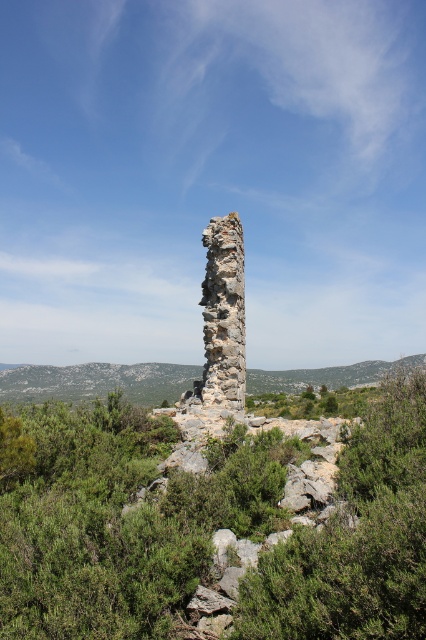
Question: Which of the following is the farthest from the observer?

Choices:
 (A) green leafy shrubs at center
 (B) green mossy hillside at center

Answer: (B)

Question: Which point is closer to the camera?

Choices:
 (A) (97, 385)
 (B) (374, 634)
 (C) (32, 588)

Answer: (B)

Question: Which point is farther to the camera?

Choices:
 (A) green leafy shrubs at center
 (B) green mossy hillside at center
 (C) green leafy shrub at center

Answer: (B)

Question: Is green leafy shrub at center closer to camera compared to green mossy hillside at center?

Choices:
 (A) no
 (B) yes

Answer: (B)

Question: Is green leafy shrub at center bigger than green mossy hillside at center?

Choices:
 (A) no
 (B) yes

Answer: (A)

Question: Can you confirm if green leafy shrubs at center is wider than green mossy hillside at center?

Choices:
 (A) no
 (B) yes

Answer: (A)